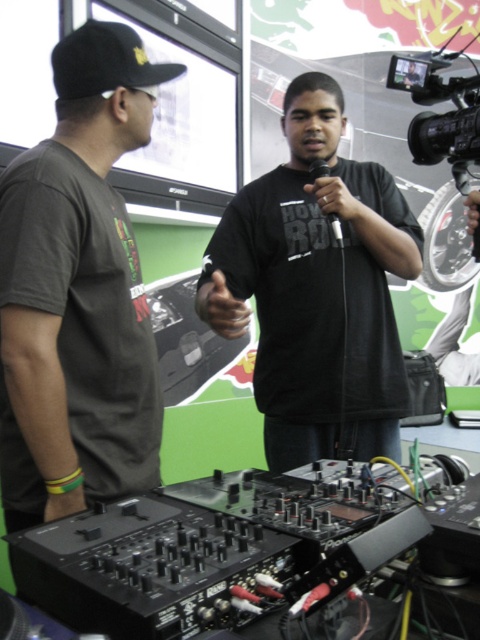
Does black matte shirt at center appear over black matte microphone at center?

Incorrect, black matte shirt at center is not positioned above black matte microphone at center.

Between black matte shirt at center and black matte microphone at center, which one has less height?

Standing shorter between the two is black matte microphone at center.

The width and height of the screenshot is (480, 640). What do you see at coordinates (315, 289) in the screenshot?
I see `black matte shirt at center` at bounding box center [315, 289].

Where is `black matte shirt at center`? black matte shirt at center is located at coordinates (315, 289).

Which is more to the right, black plastic video camera at upper right or black matte baseball cap at upper left?

black plastic video camera at upper right is more to the right.

Is black plastic video camera at upper right in front of black matte baseball cap at upper left?

No, black plastic video camera at upper right is behind black matte baseball cap at upper left.

Is point (391, 84) positioned in front of point (80, 74)?

That is False.

Locate an element on the screen. black plastic video camera at upper right is located at coordinates (443, 113).

In the scene shown: Is black plastic video camera at upper right wider than black matte microphone at center?

Correct, the width of black plastic video camera at upper right exceeds that of black matte microphone at center.

How much distance is there between black plastic video camera at upper right and black matte microphone at center?

They are 10.81 inches apart.

Is point (425, 116) behind point (336, 241)?

That is False.

Image resolution: width=480 pixels, height=640 pixels. I want to click on black plastic video camera at upper right, so click(443, 113).